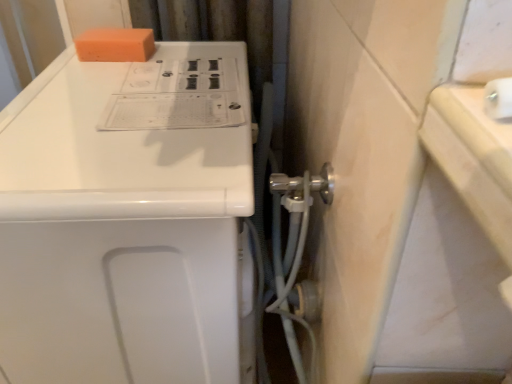
Where is `vacant region to the right of orange sponge at upper left`? vacant region to the right of orange sponge at upper left is located at coordinates (195, 57).